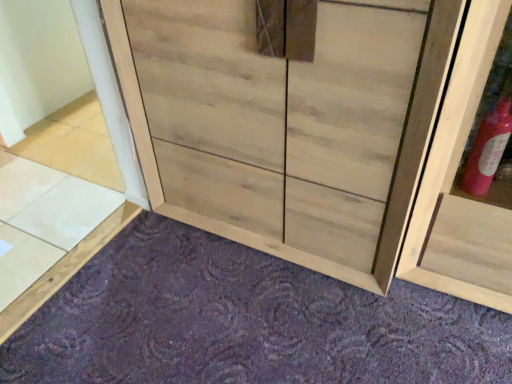
Image resolution: width=512 pixels, height=384 pixels. What do you see at coordinates (73, 149) in the screenshot?
I see `light brown wood tile at lower left` at bounding box center [73, 149].

Where is `purple carpet at lower center`? Image resolution: width=512 pixels, height=384 pixels. purple carpet at lower center is located at coordinates (244, 322).

This screenshot has height=384, width=512. Identify the location of light brown wood tile at lower left. (73, 149).

Which of these two, natural wood cupboard at center or purple carpet at lower center, stands shorter?

purple carpet at lower center.

From the image's perspective, between natural wood cupboard at center and purple carpet at lower center, which one is located above?

From the image's view, natural wood cupboard at center is above.

Is natural wood cupboard at center inside the boundaries of purple carpet at lower center, or outside?

natural wood cupboard at center is outside purple carpet at lower center.

Is natural wood cupboard at center oriented towards purple carpet at lower center?

Yes.

How much distance is there between light brown wood tile at lower left and natural wood cupboard at center?

31.61 inches.

Which is more to the left, light brown wood tile at lower left or natural wood cupboard at center?

From the viewer's perspective, light brown wood tile at lower left appears more on the left side.

Considering the points (101, 153) and (365, 260), which point is in front, point (101, 153) or point (365, 260)?

The point (365, 260) is more forward.

From a real-world perspective, between light brown wood tile at lower left and natural wood cupboard at center, who is vertically lower?

light brown wood tile at lower left.

Does natural wood cupboard at center come behind light brown wood tile at lower left?

No, natural wood cupboard at center is closer to the viewer.

Looking at this image, are natural wood cupboard at center and light brown wood tile at lower left beside each other?

No, natural wood cupboard at center is not with light brown wood tile at lower left.

Is natural wood cupboard at center spatially inside light brown wood tile at lower left, or outside of it?

natural wood cupboard at center is not enclosed by light brown wood tile at lower left.

Which object is closer to the camera, purple carpet at lower center or light brown wood tile at lower left?

purple carpet at lower center.

Is purple carpet at lower center aimed at light brown wood tile at lower left?

Yes, purple carpet at lower center is aimed at light brown wood tile at lower left.

How much distance is there between purple carpet at lower center and light brown wood tile at lower left?

purple carpet at lower center is 32.83 inches away from light brown wood tile at lower left.

From a real-world perspective, which is physically below, purple carpet at lower center or light brown wood tile at lower left?

purple carpet at lower center.

From a real-world perspective, is light brown wood tile at lower left physically below purple carpet at lower center?

No, from a real-world perspective, light brown wood tile at lower left is not below purple carpet at lower center.

Can you confirm if light brown wood tile at lower left is positioned to the left of purple carpet at lower center?

Yes.

Does light brown wood tile at lower left turn towards purple carpet at lower center?

No, light brown wood tile at lower left is not oriented towards purple carpet at lower center.

Based on the photo, from the image's perspective, does light brown wood tile at lower left appear higher than purple carpet at lower center?

Yes, from the image's perspective, light brown wood tile at lower left is over purple carpet at lower center.

Is purple carpet at lower center shorter than natural wood cupboard at center?

Yes.

Between point (261, 307) and point (306, 244), which one is positioned behind?

Point (306, 244)

Consider the image. From a real-world perspective, is purple carpet at lower center physically located above or below natural wood cupboard at center?

purple carpet at lower center is situated lower than natural wood cupboard at center in the real world.

From the image's perspective, is purple carpet at lower center under natural wood cupboard at center?

Yes.

This screenshot has height=384, width=512. I want to click on plain in front of the natural wood cupboard at center, so click(244, 322).

Where is `tile below the natural wood cupboard at center (from the image's perspective)`? tile below the natural wood cupboard at center (from the image's perspective) is located at coordinates (73, 149).

Based on their spatial positions, is light brown wood tile at lower left or natural wood cupboard at center further from purple carpet at lower center?

The object further to purple carpet at lower center is light brown wood tile at lower left.

Looking at the image, which one is located closer to natural wood cupboard at center, purple carpet at lower center or light brown wood tile at lower left?

purple carpet at lower center lies closer to natural wood cupboard at center than the other object.

Which object lies further to the anchor point purple carpet at lower center, natural wood cupboard at center or light brown wood tile at lower left?

Among the two, light brown wood tile at lower left is located further to purple carpet at lower center.

Looking at the image, which one is located closer to light brown wood tile at lower left, purple carpet at lower center or natural wood cupboard at center?

natural wood cupboard at center.

When comparing their distances from natural wood cupboard at center, does light brown wood tile at lower left or purple carpet at lower center seem further?

The object further to natural wood cupboard at center is light brown wood tile at lower left.

Looking at the image, which one is located further to light brown wood tile at lower left, natural wood cupboard at center or purple carpet at lower center?

The object further to light brown wood tile at lower left is purple carpet at lower center.

Identify the location of cupboard between purple carpet at lower center and light brown wood tile at lower left from front to back. (287, 123).